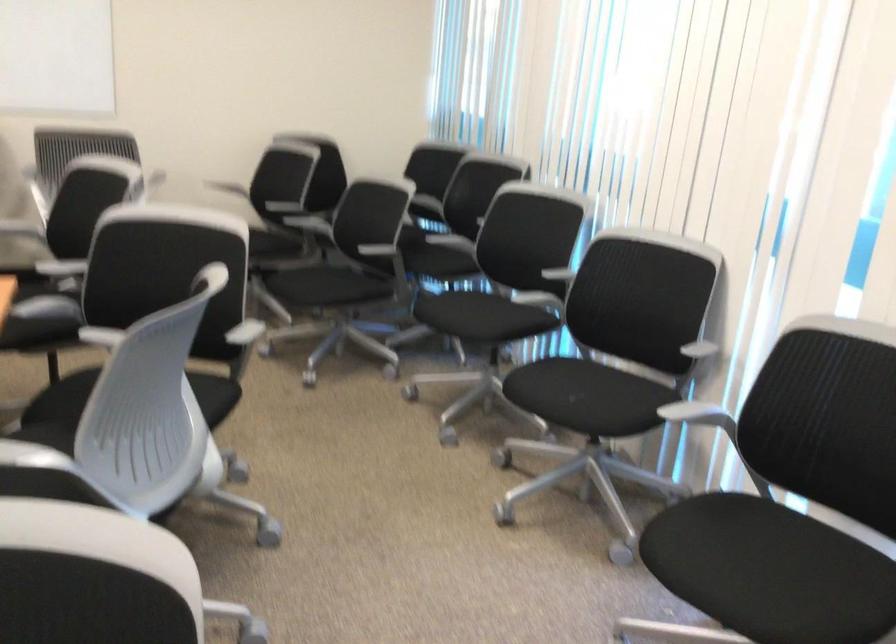
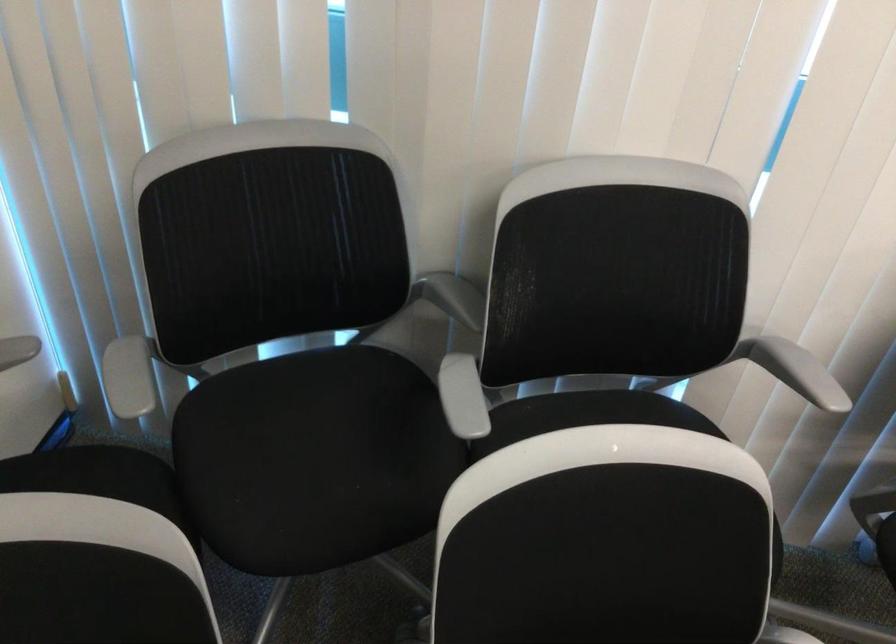
Locate, in the second image, the point that corresponds to point 463,196 in the first image.

(453, 297)